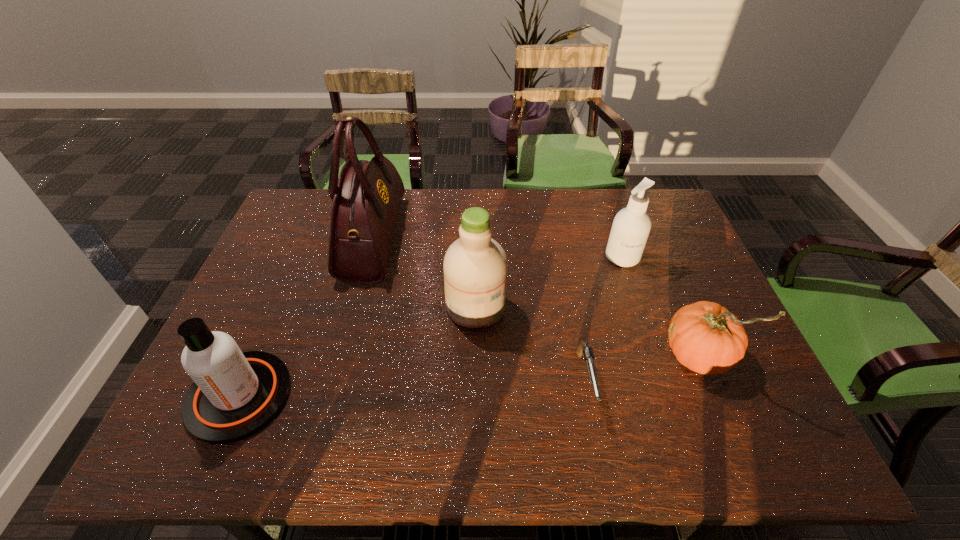
The image size is (960, 540). Identify the location of the tallest object. (366, 197).

I want to click on the second object from left to right, so click(x=366, y=197).

Locate an element on the screen. This screenshot has height=540, width=960. the second nearest cleansing agent is located at coordinates (475, 266).

You are a GUI agent. You are given a task and a screenshot of the screen. Output one action in this format:
    pyautogui.click(x=<x>, y=<y>)
    Task: Click on the second cleansing agent from left to right
    This screenshot has height=540, width=960.
    Given the screenshot: What is the action you would take?
    pyautogui.click(x=475, y=266)

The image size is (960, 540). I want to click on the farthest cleansing agent, so click(631, 226).

Identify the location of pumpkin. (705, 337).

I want to click on the leftmost cleansing agent, so click(235, 394).

Locate an element on the screen. The image size is (960, 540). the nearest cleansing agent is located at coordinates (235, 394).

Where is `the shortest object`? the shortest object is located at coordinates (583, 349).

Where is `the fourth object from left to right`? Image resolution: width=960 pixels, height=540 pixels. the fourth object from left to right is located at coordinates (583, 349).